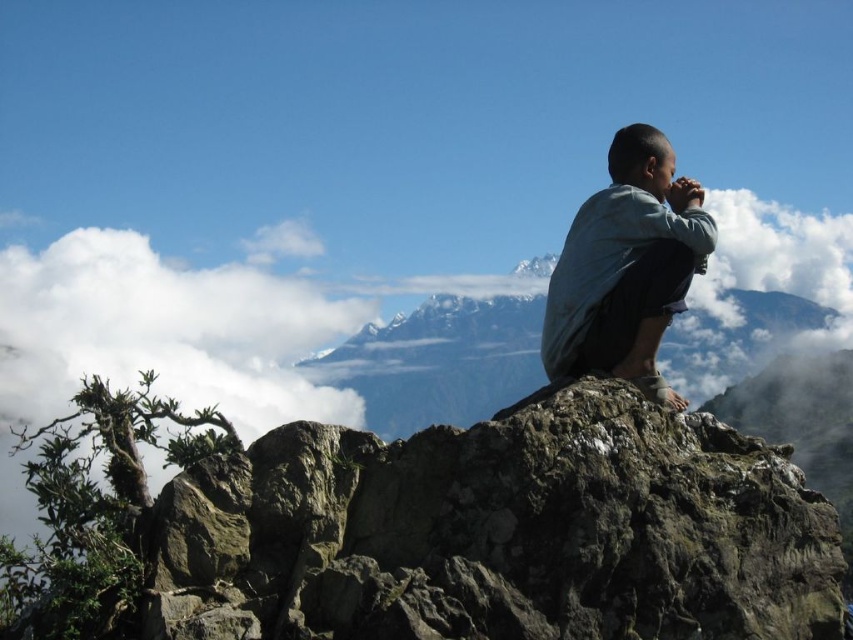
You are a hiker who wants to sit on the rough textured rock at center. However, you are wearing a light blue denim shirt at upper right. Is there enough space for you to sit without the shirt touching the rock?

The rough textured rock at center is shorter than the light blue denim shirt at upper right. Since the rock is shorter, there might not be enough vertical space for the shirt to avoid contact when sitting. The shirt could potentially touch the rock depending on your sitting position.

You are standing at the origin point of the coordinate system in the scene. The rough textured rock at center is located at coordinate point 0.831 on the x axis and 0.587 on the y axis. If you want to move towards the rock, in which direction should you move along the x and y axes?

To move towards the rough textured rock at center from the origin, you should move in the positive direction along both the x and y axes since its coordinates are 0.831 on the x axis and 0.587 on the y axis, which are both greater than zero.